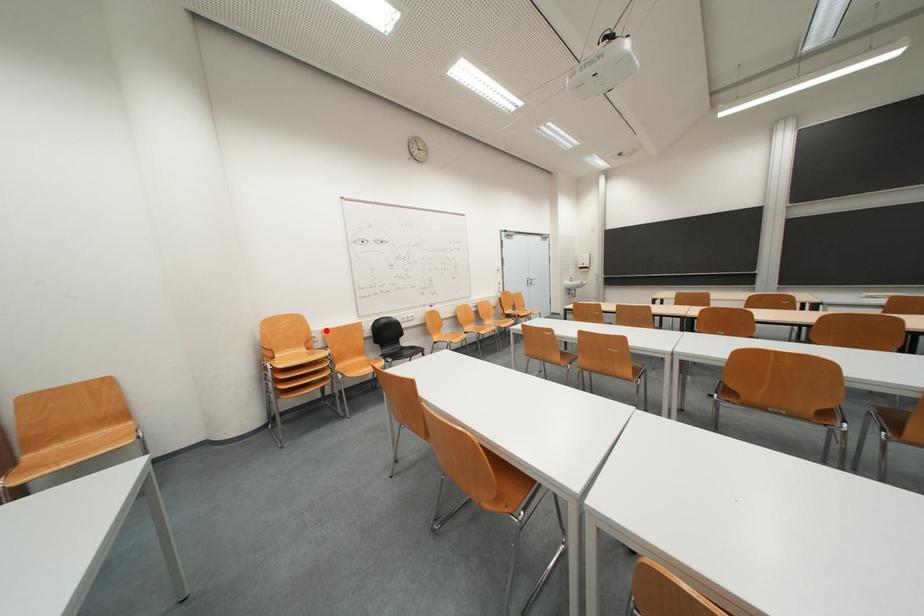
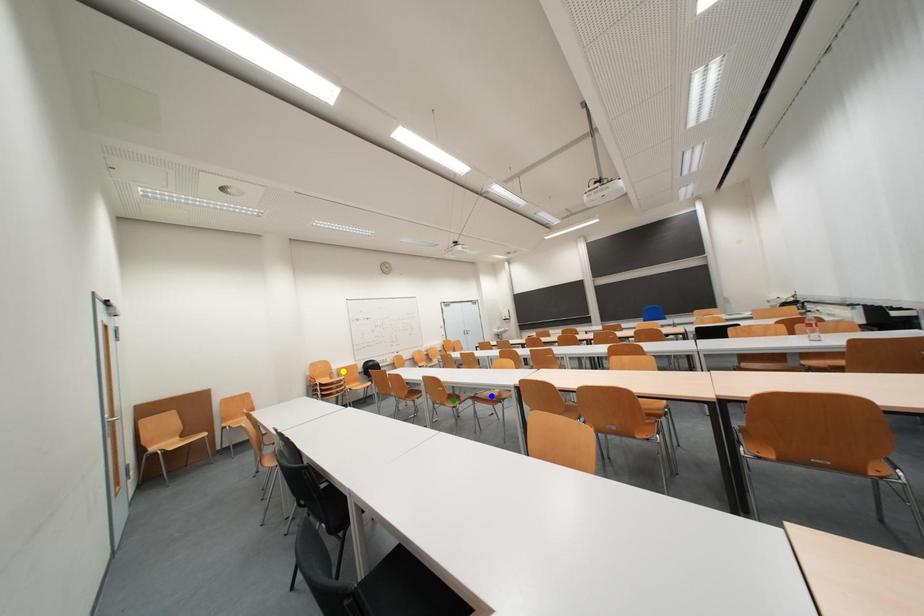
Question: I am providing you with two images of the same scene from different viewpoints. A red point is marked on the first image. You are given multiple points on the second image. Can you choose the point in image 2 that corresponds to the point in image 1?

Choices:
 (A) yellow point
 (B) green point
 (C) blue point

Answer: (A)